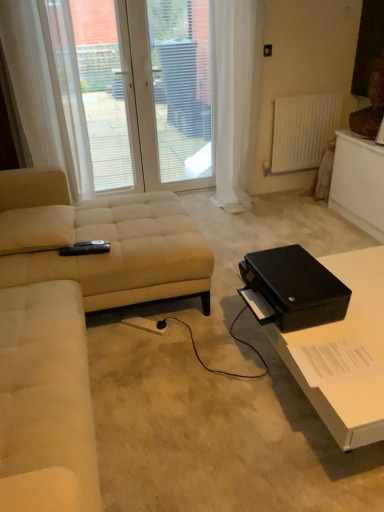
Identify the location of vacant area on top of black matte box at right (from a real-world perspective). (288, 271).